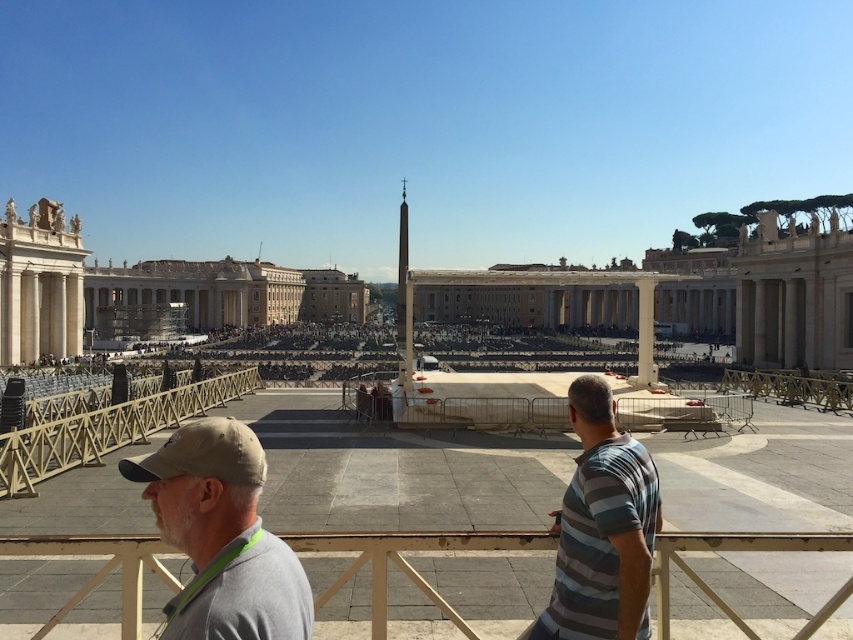
Does gray fabric cap at lower left have a lesser width compared to beige metal rail at lower center?

Yes.

Can you confirm if gray fabric cap at lower left is taller than beige metal rail at lower center?

Yes, gray fabric cap at lower left is taller than beige metal rail at lower center.

Who is more distant from viewer, (286, 616) or (674, 540)?

Point (674, 540)

Locate an element on the screen. The width and height of the screenshot is (853, 640). gray fabric cap at lower left is located at coordinates (221, 536).

Who is higher up, gray fabric cap at lower left or wooden at left?

wooden at left

Which is in front, point (235, 627) or point (49, 456)?

Point (235, 627) is more forward.

Is point (201, 508) closer to viewer compared to point (44, 465)?

Yes, point (201, 508) is in front of point (44, 465).

This screenshot has height=640, width=853. In order to click on gray fabric cap at lower left in this screenshot , I will do `click(221, 536)`.

Who is shorter, beige metal rail at lower center or striped cotton shirt at center?

With less height is beige metal rail at lower center.

Who is positioned more to the right, beige metal rail at lower center or striped cotton shirt at center?

Positioned to the right is striped cotton shirt at center.

Is point (815, 532) more distant than point (621, 444)?

No, it is not.

The image size is (853, 640). Find the location of `beige metal rail at lower center`. beige metal rail at lower center is located at coordinates (407, 563).